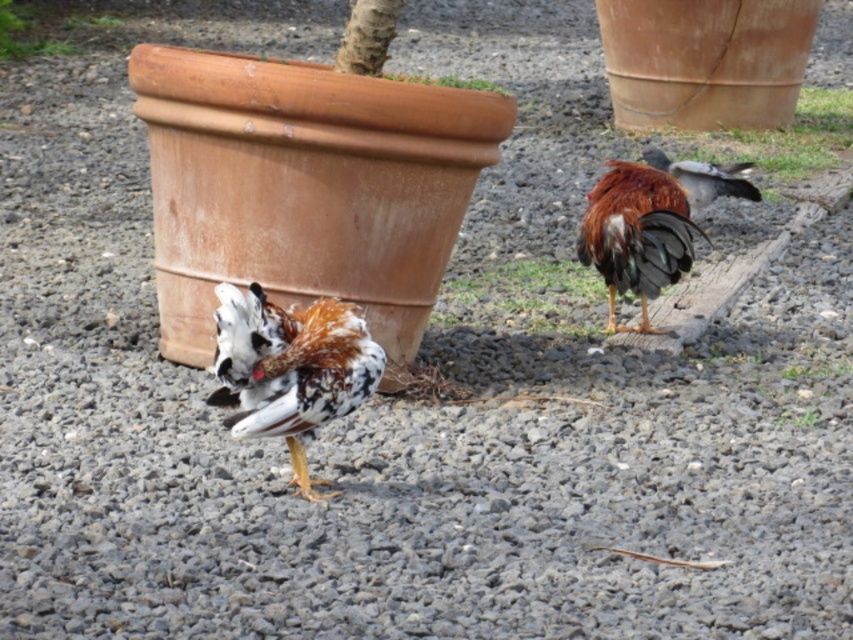
Is brown speckled feather at right further to the viewer compared to green leafy plant at lower center?

Yes, it is.

Who is positioned more to the left, brown speckled feather at right or green leafy plant at lower center?

Positioned to the left is green leafy plant at lower center.

Is point (700, 188) in front of point (791, 420)?

No, it is not.

Locate an element on the screen. brown speckled feather at right is located at coordinates (704, 177).

Which is more to the right, speckled feathered chicken at center or brown speckled feather at right?

From the viewer's perspective, brown speckled feather at right appears more on the right side.

Which is more to the left, speckled feathered chicken at center or brown speckled feather at right?

speckled feathered chicken at center is more to the left.

Which is behind, point (276, 419) or point (697, 188)?

The point (697, 188) is behind.

The height and width of the screenshot is (640, 853). What are the coordinates of `speckled feathered chicken at center` in the screenshot? It's located at click(x=289, y=369).

Does matte brown pot at upper right have a lesser height compared to green leafy plant at lower center?

Incorrect, matte brown pot at upper right's height does not fall short of green leafy plant at lower center's.

Does matte brown pot at upper right have a greater width compared to green leafy plant at lower center?

Indeed, matte brown pot at upper right has a greater width compared to green leafy plant at lower center.

Who is more distant from viewer, (x=763, y=134) or (x=820, y=412)?

The point (x=763, y=134) is behind.

I want to click on matte brown pot at upper right, so click(775, 138).